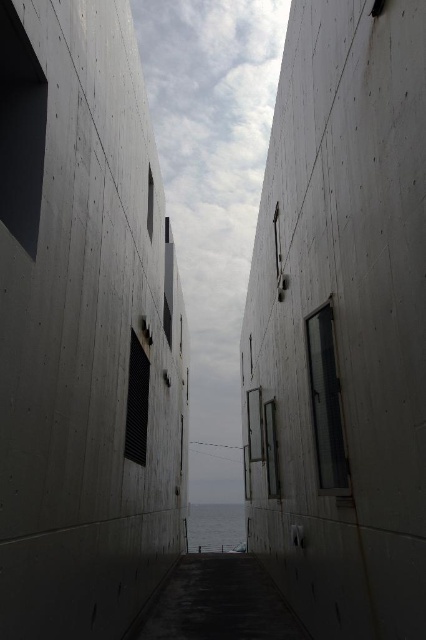
Question: Which object is farther from the camera taking this photo?

Choices:
 (A) concrete textured wall at center
 (B) blue water at center

Answer: (B)

Question: Is dark gray concrete at center below blue water at center?

Choices:
 (A) no
 (B) yes

Answer: (A)

Question: Can you confirm if concrete textured wall at center is bigger than blue water at center?

Choices:
 (A) yes
 (B) no

Answer: (B)

Question: Among these objects, which one is nearest to the camera?

Choices:
 (A) concrete textured wall at center
 (B) dark gray concrete at center
 (C) smooth concrete wall at center

Answer: (A)

Question: Estimate the real-world distances between objects in this image. Which object is farther from the concrete textured wall at center?

Choices:
 (A) blue water at center
 (B) dark gray concrete at center
 (C) smooth concrete wall at center

Answer: (A)

Question: Observing the image, what is the correct spatial positioning of concrete textured wall at center in reference to blue water at center?

Choices:
 (A) left
 (B) right

Answer: (A)